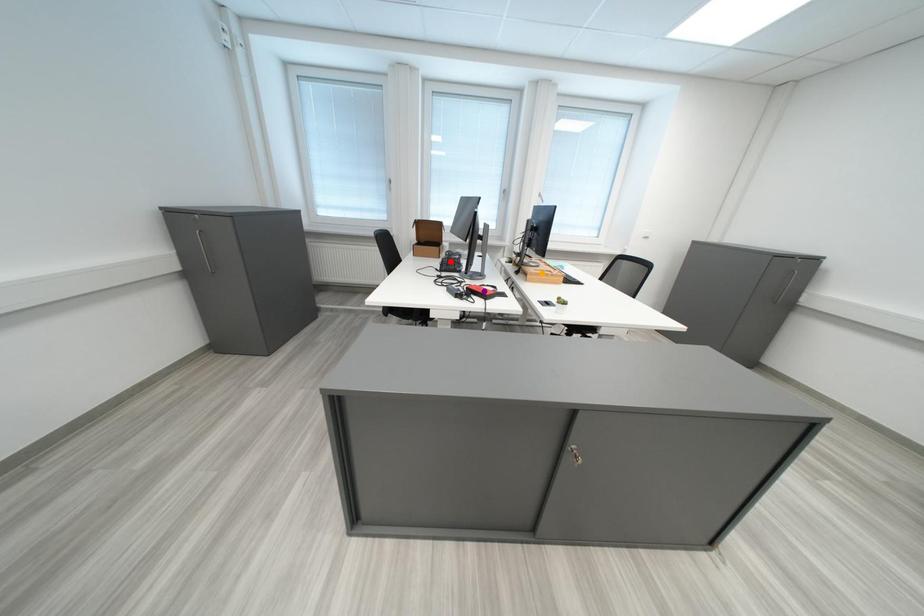
Order these from farthest to nearest:
orange point
purple point
red point

orange point → red point → purple point